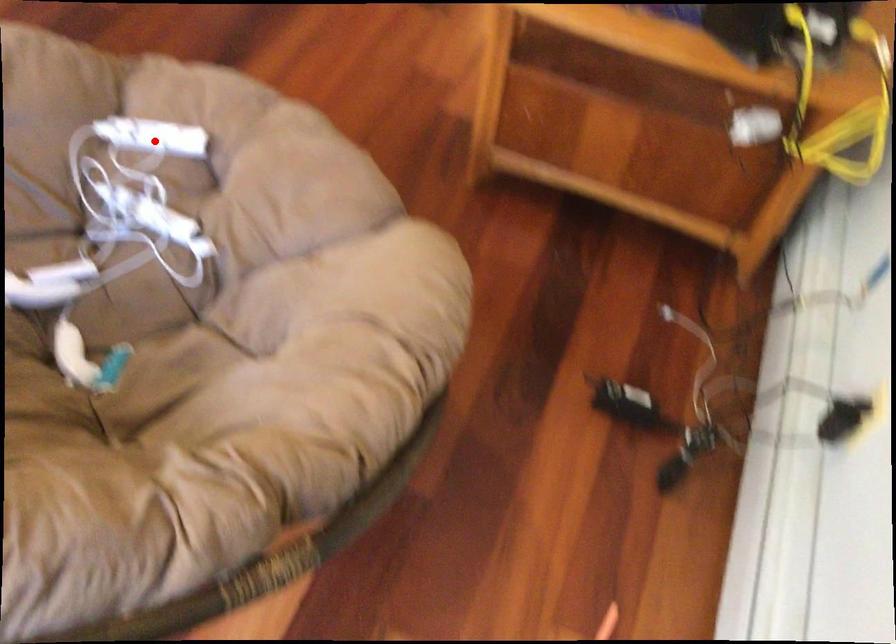
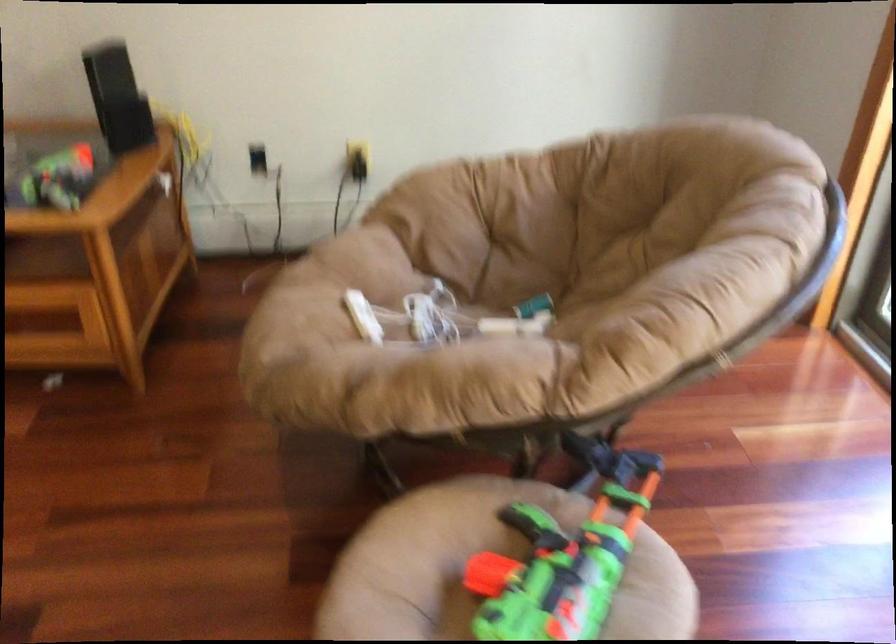
Find the pixel in the second image that matches the highlighted location in the first image.

(363, 317)